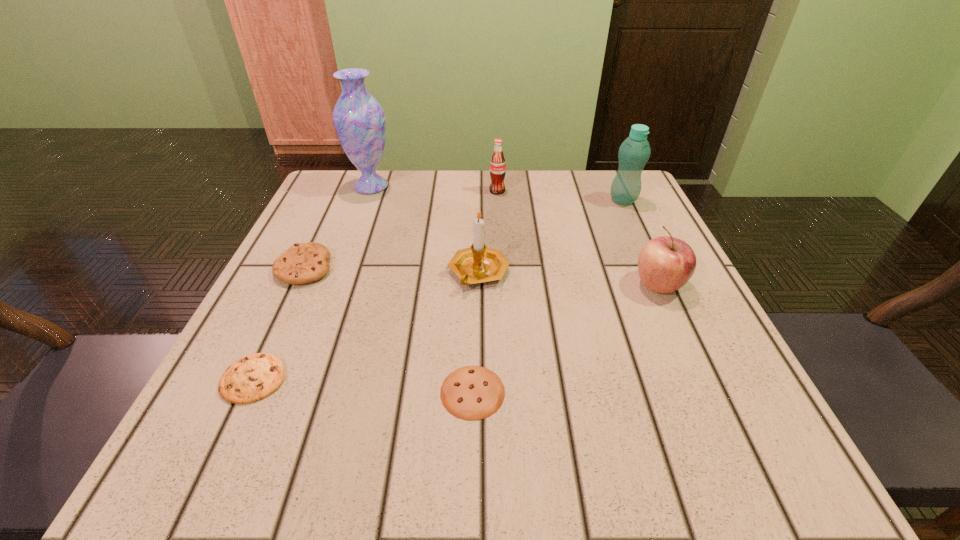
The image size is (960, 540). In the image, there is a desktop. What are the coordinates of `free space at the far left corner` in the screenshot? It's located at (324, 209).

The width and height of the screenshot is (960, 540). Identify the location of free space at the far right corner. (599, 211).

You are a GUI agent. You are given a task and a screenshot of the screen. Output one action in this format:
    pyautogui.click(x=<x>, y=<y>)
    Task: Click on the vacant area that lies between the candle holder and the water bottle
    The width and height of the screenshot is (960, 540).
    Given the screenshot: What is the action you would take?
    pyautogui.click(x=551, y=237)

Locate an element on the screen. The height and width of the screenshot is (540, 960). free space between the second tallest cookie and the shortest cookie is located at coordinates (363, 386).

You are a GUI agent. You are given a task and a screenshot of the screen. Output one action in this format:
    pyautogui.click(x=<x>, y=<y>)
    Task: Click on the vacant space in between the third shortest object and the soda
    
    Given the screenshot: What is the action you would take?
    (x=401, y=230)

The image size is (960, 540). In order to click on empty space between the vase and the candle holder in this screenshot , I will do [x=425, y=230].

Where is `free space between the tallest object and the soda`? The width and height of the screenshot is (960, 540). free space between the tallest object and the soda is located at coordinates (434, 188).

Locate an element on the screen. free space between the soda and the seventh tallest object is located at coordinates (375, 285).

I want to click on free spot between the second shortest object and the vase, so click(313, 283).

In order to click on blank region between the vase and the apple in this screenshot , I will do `click(515, 235)`.